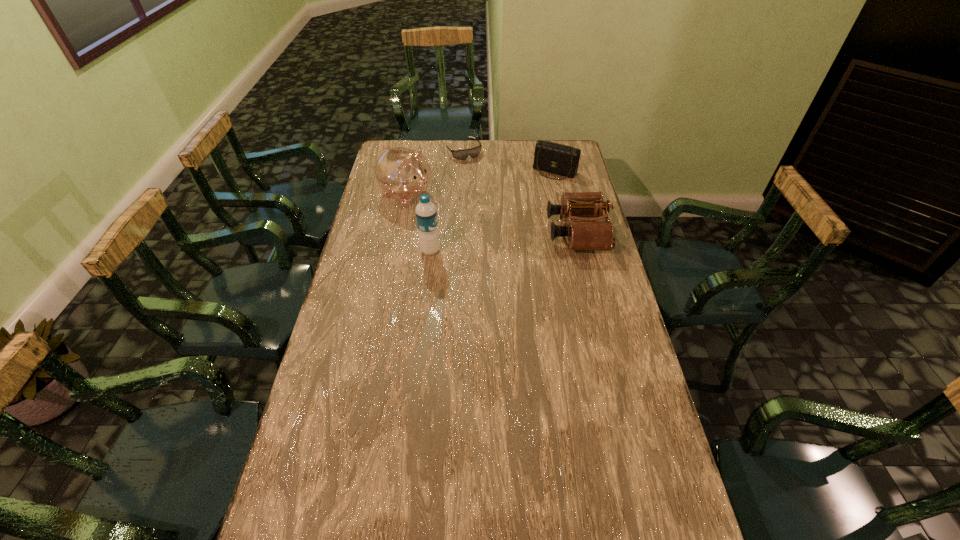
This screenshot has width=960, height=540. I want to click on goggles that is at the far edge, so click(473, 152).

Locate an element on the screen. object located at the left edge is located at coordinates (402, 173).

The image size is (960, 540). I want to click on binoculars located at the right edge, so click(x=588, y=234).

Image resolution: width=960 pixels, height=540 pixels. In order to click on clutch bag that is at the right edge in this screenshot , I will do `click(551, 157)`.

This screenshot has height=540, width=960. In order to click on object located in the far right corner section of the desktop in this screenshot , I will do `click(551, 157)`.

Locate an element on the screen. free location at the left edge is located at coordinates (392, 214).

In the image, there is a desktop. Identify the location of vacant space at the right edge. Image resolution: width=960 pixels, height=540 pixels. (590, 355).

This screenshot has height=540, width=960. Find the location of `vacant space that is in between the shortest object and the clutch bag`. vacant space that is in between the shortest object and the clutch bag is located at coordinates (509, 161).

At what (x,y) coordinates should I click in order to perform the action: click on blank region between the binoculars and the farthest object. Please return your answer as a coordinate pair (x, y). The width and height of the screenshot is (960, 540). Looking at the image, I should click on (520, 192).

At what (x,y) coordinates should I click in order to perform the action: click on empty space that is in between the piggy bank and the shortest object. Please return your answer as a coordinate pair (x, y). The height and width of the screenshot is (540, 960). Looking at the image, I should click on (435, 173).